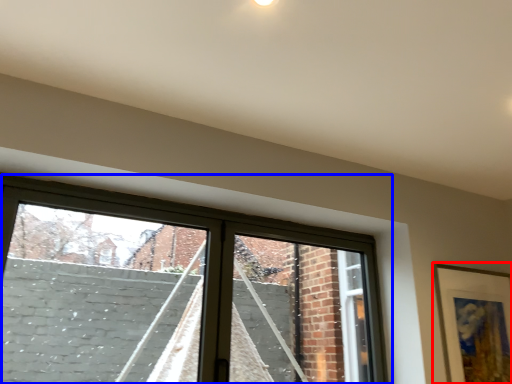
Question: Among these objects, which one is nearest to the camera, picture frame (highlighted by a red box) or window (highlighted by a blue box)?

Choices:
 (A) picture frame
 (B) window

Answer: (B)